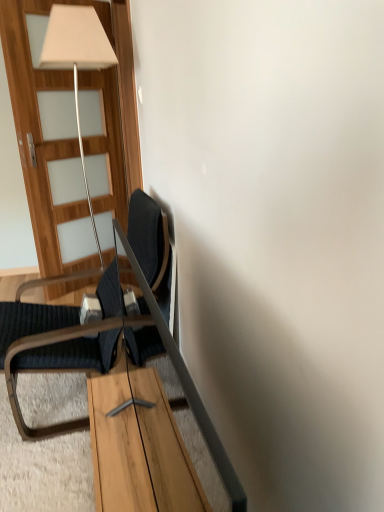
You are a GUI agent. You are given a task and a screenshot of the screen. Output one action in this format:
    pyautogui.click(x=<x>, y=<y>)
    Task: Click on the blank space situated above wooden table at center (from a real-world perspective)
    
    Given the screenshot: What is the action you would take?
    pyautogui.click(x=116, y=435)